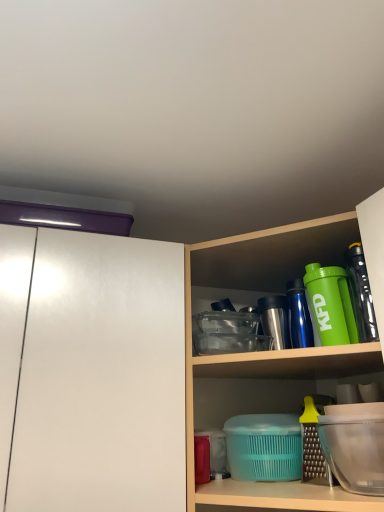
Image resolution: width=384 pixels, height=512 pixels. What are the coordinates of `transparent plastic container at lower right` in the screenshot? It's located at pyautogui.click(x=355, y=445).

The width and height of the screenshot is (384, 512). I want to click on translucent plastic containers at center, so click(x=105, y=377).

Is white glossy cabinet at left wider or thinner than translucent plastic containers at center?

white glossy cabinet at left is thinner than translucent plastic containers at center.

Can you tell me how much white glossy cabinet at left and translucent plastic containers at center differ in facing direction?

The facing directions of white glossy cabinet at left and translucent plastic containers at center are 44.3 degrees apart.

Which is more to the left, white glossy cabinet at left or translucent plastic containers at center?

white glossy cabinet at left.

Which of these two, white glossy cabinet at left or translucent plastic containers at center, stands shorter?

white glossy cabinet at left is shorter.

You are a GUI agent. You are given a task and a screenshot of the screen. Output one action in this format:
    pyautogui.click(x=<x>, y=<y>)
    Task: Click on the bottle behind the green matte shaker at upper right, the 2th bottle when ordered from back to front
    
    Given the screenshot: What is the action you would take?
    pyautogui.click(x=299, y=315)

Between green matte shaker at upper right, which appears as the first bottle when viewed from the back, and green matte shaker at upper right, the 1th bottle viewed from the front, which one appears on the right side from the viewer's perspective?

green matte shaker at upper right, the 1th bottle viewed from the front.

From their relative heights in the image, would you say green matte shaker at upper right, which appears as the first bottle when viewed from the back, is taller or shorter than green matte shaker at upper right, the 2th bottle when ordered from back to front?

Considering their sizes, green matte shaker at upper right, which appears as the first bottle when viewed from the back, has more height than green matte shaker at upper right, the 2th bottle when ordered from back to front.

From the image's perspective, would you say green matte shaker at upper right, which appears as the first bottle when viewed from the back, is shown under green matte shaker at upper right, the 2th bottle when ordered from back to front?

Correct, green matte shaker at upper right, which appears as the first bottle when viewed from the back, appears lower than green matte shaker at upper right, the 2th bottle when ordered from back to front, in the image.

Considering the relative positions of white glossy cabinet at left and green matte shaker at upper right, which appears as the first bottle when viewed from the back, in the image provided, is white glossy cabinet at left in front of green matte shaker at upper right, which appears as the first bottle when viewed from the back,?

Yes, it is in front of green matte shaker at upper right, which appears as the first bottle when viewed from the back.

Considering the relative positions of white glossy cabinet at left and green matte shaker at upper right, which appears as the first bottle when viewed from the back, in the image provided, is white glossy cabinet at left to the left of green matte shaker at upper right, which appears as the first bottle when viewed from the back, from the viewer's perspective?

Yes.

Which is less distant, (83, 355) or (292, 309)?

Point (83, 355) appears to be closer to the viewer than point (292, 309).

From a real-world perspective, is white glossy cabinet at left beneath green matte shaker at upper right, the 2th bottle when ordered from front to back?

Yes, from a real-world perspective, white glossy cabinet at left is under green matte shaker at upper right, the 2th bottle when ordered from front to back.

Is point (53, 254) farther from camera compared to point (320, 281)?

Yes, point (53, 254) is farther from viewer.

From the picture: Is translucent plastic containers at center shorter than green matte shaker at upper right, the 1th bottle viewed from the front?

No.

Is translucent plastic containers at center not inside green matte shaker at upper right, the 2th bottle when ordered from back to front?

Yes.

From a real-world perspective, between translucent plastic containers at center and white glossy cabinet at left, who is vertically higher?

white glossy cabinet at left.

In the image, is translucent plastic containers at center on the left side or the right side of white glossy cabinet at left?

Based on their positions, translucent plastic containers at center is located to the right of white glossy cabinet at left.

Consider the image. Is translucent plastic containers at center next to white glossy cabinet at left and touching it?

Yes, translucent plastic containers at center is right next to white glossy cabinet at left and making contact.

From the image's perspective, which is below, translucent plastic containers at center or white glossy cabinet at left?

translucent plastic containers at center.

Which point is more distant from viewer, (110, 454) or (330, 308)?

Positioned behind is point (330, 308).

Can you confirm if white glossy cabinet at left is bigger than green matte shaker at upper right, the 2th bottle when ordered from back to front?

Correct, white glossy cabinet at left is larger in size than green matte shaker at upper right, the 2th bottle when ordered from back to front.

Could you tell me if white glossy cabinet at left is turned towards green matte shaker at upper right, the 2th bottle when ordered from back to front?

No, white glossy cabinet at left is not oriented towards green matte shaker at upper right, the 2th bottle when ordered from back to front.

I want to click on glass door that appears below the green matte shaker at upper right, the 2th bottle when ordered from back to front (from the image's perspective), so click(101, 378).

Can you confirm if translucent plastic containers at center is positioned to the left of green matte shaker at upper right, which appears as the first bottle when viewed from the back?

In fact, translucent plastic containers at center is to the right of green matte shaker at upper right, which appears as the first bottle when viewed from the back.

From a real-world perspective, count 2nd bottles upward from the translucent plastic containers at center and point to it. Please provide its 2D coordinates.

[(299, 315)]

Considering the points (85, 327) and (296, 324), which point is behind, point (85, 327) or point (296, 324)?

Point (296, 324)

From the image's perspective, is translucent plastic containers at center above or below green matte shaker at upper right, which appears as the first bottle when viewed from the back?

translucent plastic containers at center is below green matte shaker at upper right, which appears as the first bottle when viewed from the back.

There is a translucent plastic containers at center. Where is `glass door above it (from a real-world perspective)`? glass door above it (from a real-world perspective) is located at coordinates (101, 378).

Find the location of a particular element. The height and width of the screenshot is (512, 384). bottle located on the right of green matte shaker at upper right, the 2th bottle when ordered from front to back is located at coordinates (329, 305).

Considering their positions, is green matte shaker at upper right, the 2th bottle when ordered from front to back, positioned further to green matte shaker at upper right, the 2th bottle when ordered from back to front, than transparent plastic container at lower right?

Among the two, transparent plastic container at lower right is located further to green matte shaker at upper right, the 2th bottle when ordered from back to front.

Considering their positions, is translucent plastic containers at center positioned closer to white glossy cabinet at left than green matte shaker at upper right, the 2th bottle when ordered from back to front?

translucent plastic containers at center is positioned closer to the anchor white glossy cabinet at left.

Which object lies further to the anchor point green matte shaker at upper right, the 1th bottle viewed from the front, translucent plastic containers at center or green matte shaker at upper right, which appears as the first bottle when viewed from the back?

translucent plastic containers at center lies further to green matte shaker at upper right, the 1th bottle viewed from the front, than the other object.

When comparing their distances from green matte shaker at upper right, which appears as the first bottle when viewed from the back, does green matte shaker at upper right, the 1th bottle viewed from the front, or transparent plastic container at lower right seem closer?

green matte shaker at upper right, the 1th bottle viewed from the front, is closer to green matte shaker at upper right, which appears as the first bottle when viewed from the back.

Which object lies nearer to the anchor point white glossy cabinet at left, translucent plastic containers at center or green matte shaker at upper right, the 2th bottle when ordered from front to back?

translucent plastic containers at center.

From the picture: Based on their spatial positions, is green matte shaker at upper right, the 1th bottle viewed from the front, or green matte shaker at upper right, which appears as the first bottle when viewed from the back, closer to white glossy cabinet at left?

The object closer to white glossy cabinet at left is green matte shaker at upper right, the 1th bottle viewed from the front.

Based on their spatial positions, is translucent plastic containers at center or green matte shaker at upper right, the 2th bottle when ordered from back to front, further from transparent plastic container at lower right?

translucent plastic containers at center is further to transparent plastic container at lower right.

When comparing their distances from transparent plastic container at lower right, does green matte shaker at upper right, the 2th bottle when ordered from front to back, or translucent plastic containers at center seem closer?

The object closer to transparent plastic container at lower right is green matte shaker at upper right, the 2th bottle when ordered from front to back.

Locate an element on the screen. This screenshot has width=384, height=512. bottle between white glossy cabinet at left and green matte shaker at upper right, the 2th bottle when ordered from back to front is located at coordinates (299, 315).

Where is `cabinetry located between white glossy cabinet at left and transparent plastic container at lower right in the left-right direction`? cabinetry located between white glossy cabinet at left and transparent plastic container at lower right in the left-right direction is located at coordinates (105, 377).

What are the coordinates of `appliance between translucent plastic containers at center and green matte shaker at upper right, which appears as the first bottle when viewed from the back, from front to back` in the screenshot? It's located at (x=355, y=445).

The image size is (384, 512). I want to click on cabinetry located between white glossy cabinet at left and green matte shaker at upper right, the 1th bottle viewed from the front, in the left-right direction, so click(105, 377).